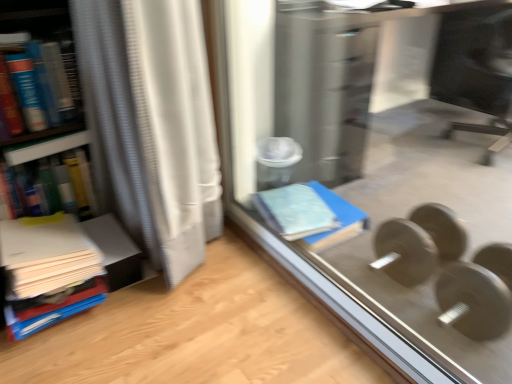
Locate an element on the screen. This screenshot has height=384, width=512. free space underneath metallic gray dumbbell at lower right, the first dumbbell in the back-to-front sequence (from a real-world perspective) is located at coordinates (407, 261).